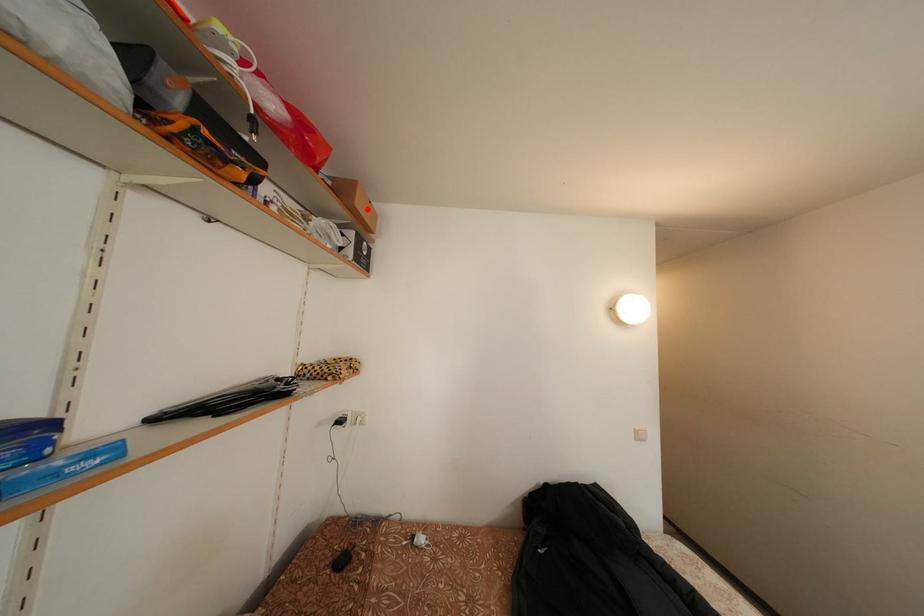
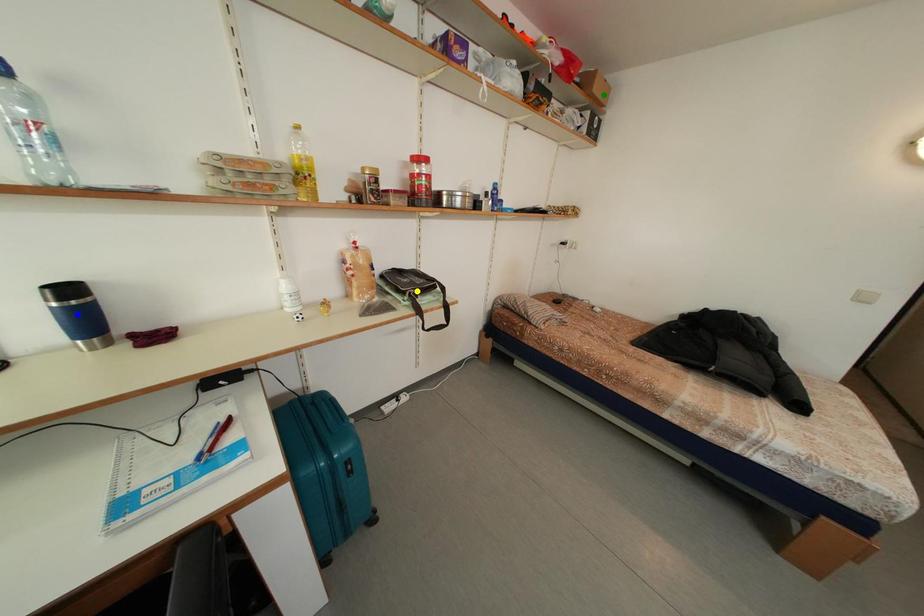
Question: I am providing you with two images of the same scene from different viewpoints. A red point is marked on the first image. You are given multiple points on the second image. In image 2, which mark is for the same physical point as the one in image 1?

Choices:
 (A) yellow point
 (B) blue point
 (C) green point

Answer: (C)